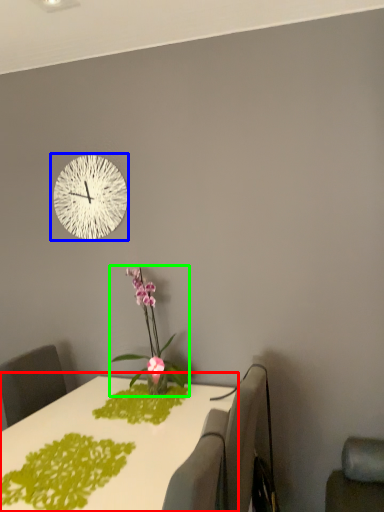
Question: Estimate the real-world distances between objects in this image. Which object is farther from table (highlighted by a red box), wall clock (highlighted by a blue box) or houseplant (highlighted by a green box)?

Choices:
 (A) wall clock
 (B) houseplant

Answer: (A)